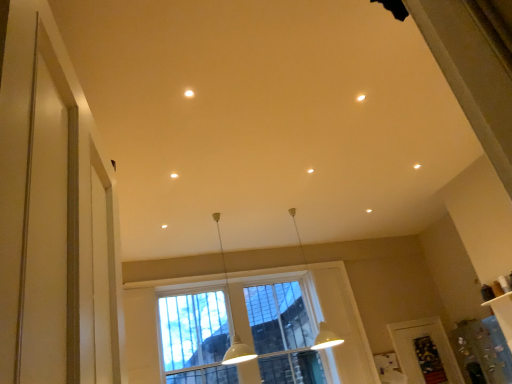
Describe the element at coordinates (425, 352) in the screenshot. I see `clear plastic screen door at lower right` at that location.

Find the location of a particular element. This screenshot has height=384, width=512. white matte pendant light at center, which is the second lamp in left-to-right order is located at coordinates (326, 338).

You are a GUI agent. You are given a task and a screenshot of the screen. Output one action in this format:
    pyautogui.click(x=<x>, y=<y>)
    Task: Click on the matte white light fixture at upper center
    The height and width of the screenshot is (384, 512).
    Given the screenshot: What is the action you would take?
    pyautogui.click(x=189, y=93)

What do you see at coordinates (282, 331) in the screenshot? The width and height of the screenshot is (512, 384). I see `clear glass window at center` at bounding box center [282, 331].

Locate an element on the screen. The height and width of the screenshot is (384, 512). clear plastic screen door at lower right is located at coordinates (425, 352).

Are clear glass window at center and matte white light fixture at upper center beside each other?

No, clear glass window at center is not with matte white light fixture at upper center.

Consider the image. Considering the sizes of objects clear glass window at center and matte white light fixture at upper center in the image provided, who is taller, clear glass window at center or matte white light fixture at upper center?

clear glass window at center.

Considering the relative sizes of clear glass window at center and matte white light fixture at upper center in the image provided, is clear glass window at center wider than matte white light fixture at upper center?

Correct, the width of clear glass window at center exceeds that of matte white light fixture at upper center.

How distant is clear glass window at center from matte white light fixture at upper center?

The distance of clear glass window at center from matte white light fixture at upper center is 13.64 feet.

Does clear plastic screen door at lower right have a greater width compared to clear glass window at center?

No, clear plastic screen door at lower right is not wider than clear glass window at center.

How far apart are clear plastic screen door at lower right and clear glass window at center?

A distance of 1.98 meters exists between clear plastic screen door at lower right and clear glass window at center.

Between clear plastic screen door at lower right and clear glass window at center, which one has less height?

clear plastic screen door at lower right is shorter.

From a real-world perspective, is clear plastic screen door at lower right physically above clear glass window at center?

No, from a real-world perspective, clear plastic screen door at lower right is not on top of clear glass window at center.

Measure the distance from clear glass window at center to white glossy pendant light at center, marked as the 2th lamp in a right-to-left arrangement.

clear glass window at center and white glossy pendant light at center, marked as the 2th lamp in a right-to-left arrangement, are 20.13 inches apart.

From a real-world perspective, is clear glass window at center under white glossy pendant light at center, marked as the 2th lamp in a right-to-left arrangement?

Correct, in the physical world, clear glass window at center is lower than white glossy pendant light at center, marked as the 2th lamp in a right-to-left arrangement.

From the image's perspective, is clear glass window at center positioned above or below white glossy pendant light at center, placed as the first lamp when sorted from left to right?

clear glass window at center is situated lower than white glossy pendant light at center, placed as the first lamp when sorted from left to right, in the image.

Is clear glass window at center positioned with its back to white glossy pendant light at center, marked as the 2th lamp in a right-to-left arrangement?

No.

From the image's perspective, is clear plastic screen door at lower right located above or below white glossy pendant light at center, marked as the 2th lamp in a right-to-left arrangement?

From the image's perspective, clear plastic screen door at lower right appears below white glossy pendant light at center, marked as the 2th lamp in a right-to-left arrangement.

Which of these two, clear plastic screen door at lower right or white glossy pendant light at center, placed as the first lamp when sorted from left to right, is smaller?

clear plastic screen door at lower right.

Is clear plastic screen door at lower right facing towards white glossy pendant light at center, placed as the first lamp when sorted from left to right?

No, clear plastic screen door at lower right is not aimed at white glossy pendant light at center, placed as the first lamp when sorted from left to right.

Would you say white glossy pendant light at center, placed as the first lamp when sorted from left to right, is inside or outside matte white light fixture at upper center?

white glossy pendant light at center, placed as the first lamp when sorted from left to right, lies outside matte white light fixture at upper center.

How many degrees apart are the facing directions of white glossy pendant light at center, placed as the first lamp when sorted from left to right, and matte white light fixture at upper center?

There is a 7.99-degree angle between the facing directions of white glossy pendant light at center, placed as the first lamp when sorted from left to right, and matte white light fixture at upper center.

Would you consider white glossy pendant light at center, marked as the 2th lamp in a right-to-left arrangement, to be distant from matte white light fixture at upper center?

That's right, there is a large distance between white glossy pendant light at center, marked as the 2th lamp in a right-to-left arrangement, and matte white light fixture at upper center.

Consider the image. In terms of height, does white glossy pendant light at center, placed as the first lamp when sorted from left to right, look taller or shorter compared to matte white light fixture at upper center?

In the image, white glossy pendant light at center, placed as the first lamp when sorted from left to right, appears to be taller than matte white light fixture at upper center.

Does clear plastic screen door at lower right have a larger size compared to matte white light fixture at upper center?

Yes, clear plastic screen door at lower right is bigger than matte white light fixture at upper center.

Considering the sizes of objects clear plastic screen door at lower right and matte white light fixture at upper center in the image provided, who is taller, clear plastic screen door at lower right or matte white light fixture at upper center?

Standing taller between the two is clear plastic screen door at lower right.

How many degrees apart are the facing directions of clear plastic screen door at lower right and matte white light fixture at upper center?

95.3 degrees separate the facing orientations of clear plastic screen door at lower right and matte white light fixture at upper center.

This screenshot has width=512, height=384. What are the coordinates of `lighting on the left of clear plastic screen door at lower right` in the screenshot? It's located at (189, 93).

Is matte white light fixture at upper center aimed at white matte pendant light at center, marked as the first lamp in a right-to-left arrangement?

No, matte white light fixture at upper center is not aimed at white matte pendant light at center, marked as the first lamp in a right-to-left arrangement.

Considering the points (188, 97) and (325, 338), which point is in front, point (188, 97) or point (325, 338)?

Point (188, 97)

Looking at the image, does matte white light fixture at upper center seem bigger or smaller compared to white matte pendant light at center, marked as the first lamp in a right-to-left arrangement?

Clearly, matte white light fixture at upper center is smaller in size than white matte pendant light at center, marked as the first lamp in a right-to-left arrangement.

In the image, there is a clear glass window at center. Where is `lighting above it (from the image's perspective)`? lighting above it (from the image's perspective) is located at coordinates (189, 93).

At what (x,y) coordinates should I click in order to perform the action: click on screen door directly beneath the clear glass window at center (from a real-world perspective). Please return your answer as a coordinate pair (x, y). The height and width of the screenshot is (384, 512). Looking at the image, I should click on (425, 352).

From the image, which object appears to be nearer to clear plastic screen door at lower right, clear glass window at center or white glossy pendant light at center, marked as the 2th lamp in a right-to-left arrangement?

Among the two, clear glass window at center is located nearer to clear plastic screen door at lower right.

Which object lies nearer to the anchor point clear glass window at center, white glossy pendant light at center, marked as the 2th lamp in a right-to-left arrangement, or matte white light fixture at upper center?

Among the two, white glossy pendant light at center, marked as the 2th lamp in a right-to-left arrangement, is located nearer to clear glass window at center.

Consider the image. Looking at the image, which one is located further to clear plastic screen door at lower right, white glossy pendant light at center, placed as the first lamp when sorted from left to right, or matte white light fixture at upper center?

matte white light fixture at upper center is further to clear plastic screen door at lower right.

Based on the photo, from the image, which object appears to be nearer to white matte pendant light at center, which is the second lamp in left-to-right order, matte white light fixture at upper center or clear glass window at center?

clear glass window at center is closer to white matte pendant light at center, which is the second lamp in left-to-right order.

Which object lies further to the anchor point white glossy pendant light at center, placed as the first lamp when sorted from left to right, clear glass window at center or white matte pendant light at center, which is the second lamp in left-to-right order?

Among the two, white matte pendant light at center, which is the second lamp in left-to-right order, is located further to white glossy pendant light at center, placed as the first lamp when sorted from left to right.

Estimate the real-world distances between objects in this image. Which object is closer to matte white light fixture at upper center, white matte pendant light at center, which is the second lamp in left-to-right order, or clear glass window at center?

clear glass window at center.

Estimate the real-world distances between objects in this image. Which object is closer to clear glass window at center, matte white light fixture at upper center or white glossy pendant light at center, placed as the first lamp when sorted from left to right?

The object closer to clear glass window at center is white glossy pendant light at center, placed as the first lamp when sorted from left to right.

Considering their positions, is white glossy pendant light at center, placed as the first lamp when sorted from left to right, positioned closer to clear glass window at center than white matte pendant light at center, which is the second lamp in left-to-right order?

white glossy pendant light at center, placed as the first lamp when sorted from left to right, is closer to clear glass window at center.

This screenshot has height=384, width=512. Find the location of `lamp between white matte pendant light at center, which is the second lamp in left-to-right order, and clear glass window at center vertically`. lamp between white matte pendant light at center, which is the second lamp in left-to-right order, and clear glass window at center vertically is located at coordinates (232, 319).

Where is `window situated between white glossy pendant light at center, placed as the first lamp when sorted from left to right, and clear plastic screen door at lower right from left to right`? The image size is (512, 384). window situated between white glossy pendant light at center, placed as the first lamp when sorted from left to right, and clear plastic screen door at lower right from left to right is located at coordinates (282, 331).

I want to click on lamp between clear glass window at center and clear plastic screen door at lower right, so point(326,338).

The width and height of the screenshot is (512, 384). Find the location of `lamp located between white glossy pendant light at center, marked as the 2th lamp in a right-to-left arrangement, and clear plastic screen door at lower right in the left-right direction`. lamp located between white glossy pendant light at center, marked as the 2th lamp in a right-to-left arrangement, and clear plastic screen door at lower right in the left-right direction is located at coordinates click(326, 338).